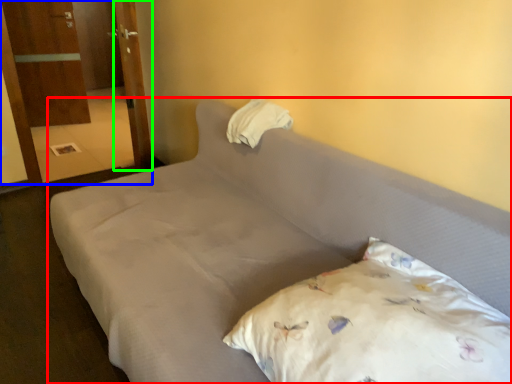
Question: Based on their relative distances, which object is nearer to bed (highlighted by a red box)? Choose from armoire (highlighted by a blue box) and door (highlighted by a green box).

Choices:
 (A) armoire
 (B) door

Answer: (B)